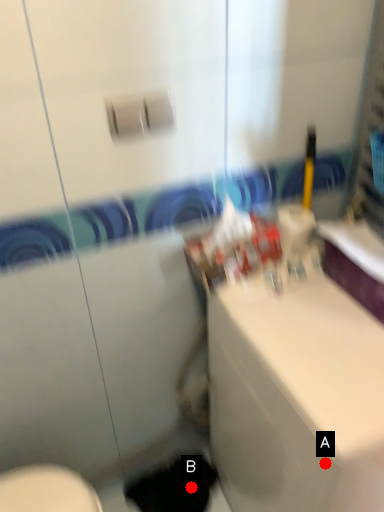
Question: Two points are circled on the image, labeled by A and B beside each circle. Which point is closer to the camera taking this photo?

Choices:
 (A) A is closer
 (B) B is closer

Answer: (A)